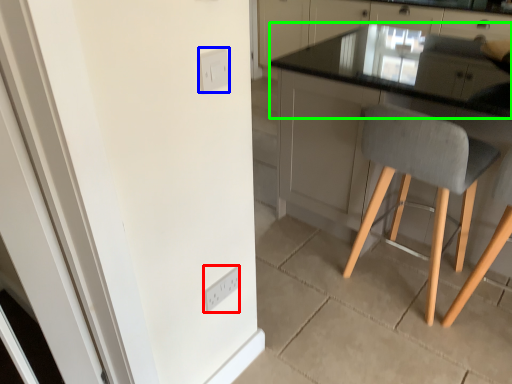
Question: Based on their relative distances, which object is nearer to light switch (highlighted by a red box)? Choose from light switch (highlighted by a blue box) and countertop (highlighted by a green box).

Choices:
 (A) light switch
 (B) countertop

Answer: (A)